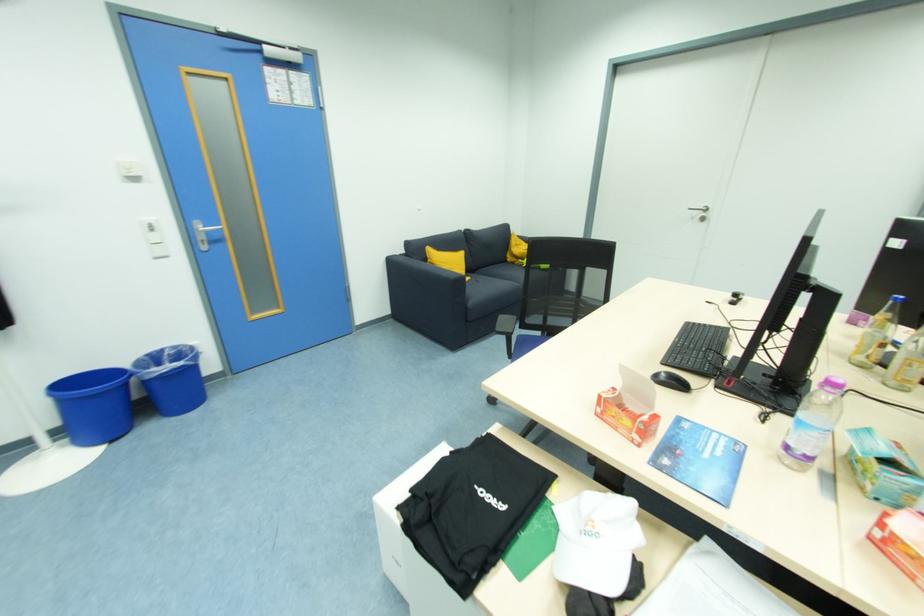
The width and height of the screenshot is (924, 616). Describe the element at coordinates (568, 254) in the screenshot. I see `the chair back top rail` at that location.